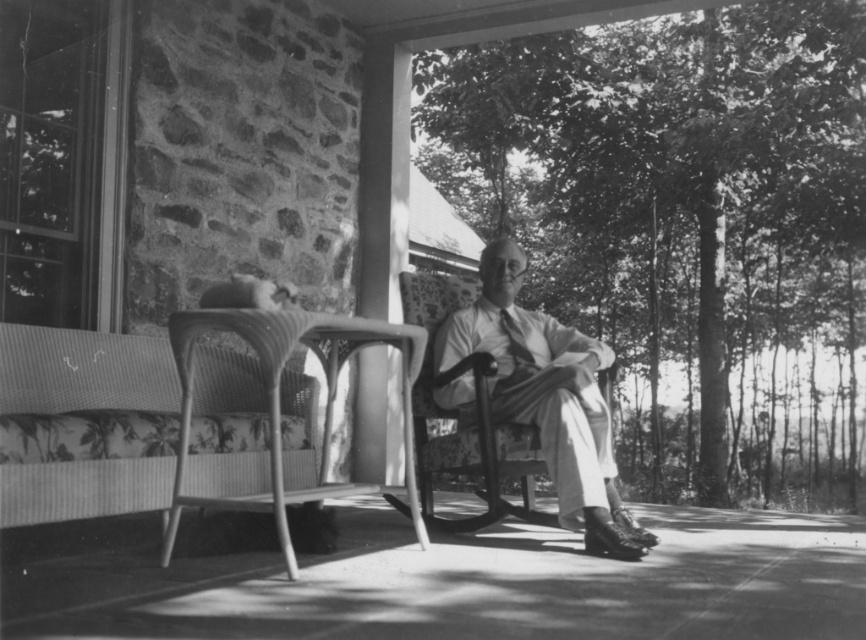
Question: Which point is farther to the camera?

Choices:
 (A) woven fabric park bench at lower left
 (B) light beige fabric chair at center

Answer: (B)

Question: Does woven fabric park bench at lower left come in front of light beige fabric chair at center?

Choices:
 (A) no
 (B) yes

Answer: (B)

Question: Is woven fabric park bench at lower left below light beige fabric chair at center?

Choices:
 (A) yes
 (B) no

Answer: (B)

Question: Can you confirm if woven fabric park bench at lower left is positioned above light beige fabric chair at center?

Choices:
 (A) no
 (B) yes

Answer: (B)